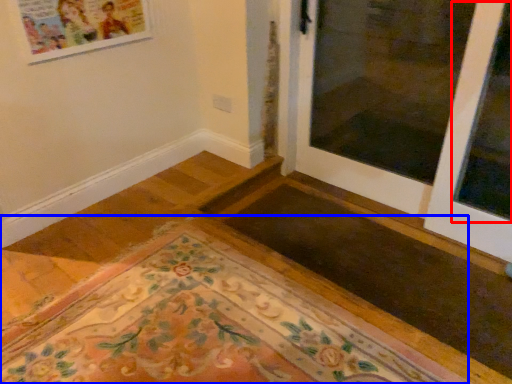
Question: Which point is closer to the camera, window (highlighted by a red box) or mat (highlighted by a blue box)?

Choices:
 (A) window
 (B) mat

Answer: (B)